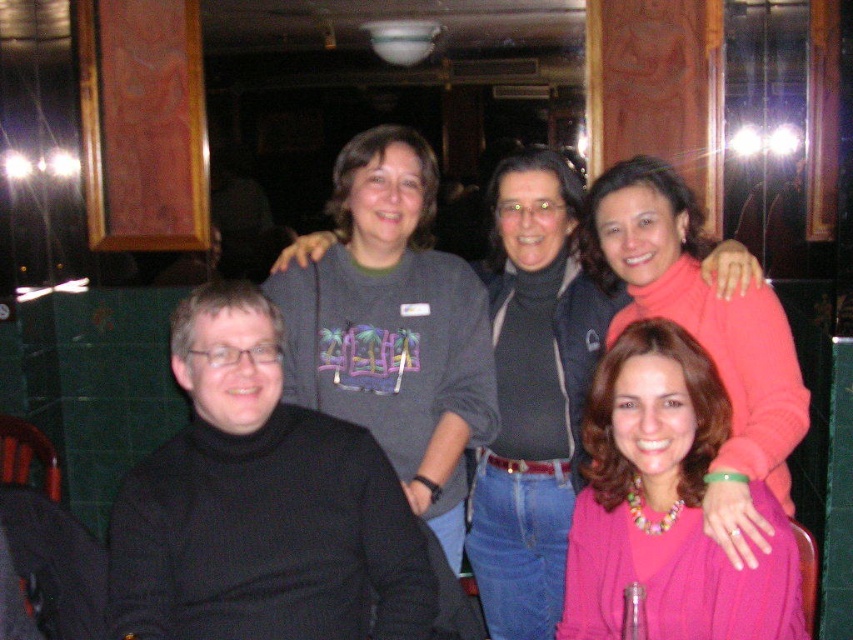
Question: Which point appears closest to the camera in this image?

Choices:
 (A) (178, 582)
 (B) (795, 387)
 (C) (630, 524)

Answer: (A)

Question: Which point is farther from the camera taking this photo?

Choices:
 (A) (289, 444)
 (B) (645, 627)

Answer: (A)

Question: Does black turtleneck sweater at left appear over pink matte sweater at upper right?

Choices:
 (A) yes
 (B) no

Answer: (B)

Question: Among these objects, which one is nearest to the camera?

Choices:
 (A) black turtleneck sweater at left
 (B) pink matte sweater at center

Answer: (B)

Question: Where is pink matte sweater at center located in relation to pink matte sweater at upper right in the image?

Choices:
 (A) above
 (B) below

Answer: (B)

Question: Where is pink matte sweater at center located in relation to pink matte sweater at upper right in the image?

Choices:
 (A) above
 (B) below

Answer: (B)